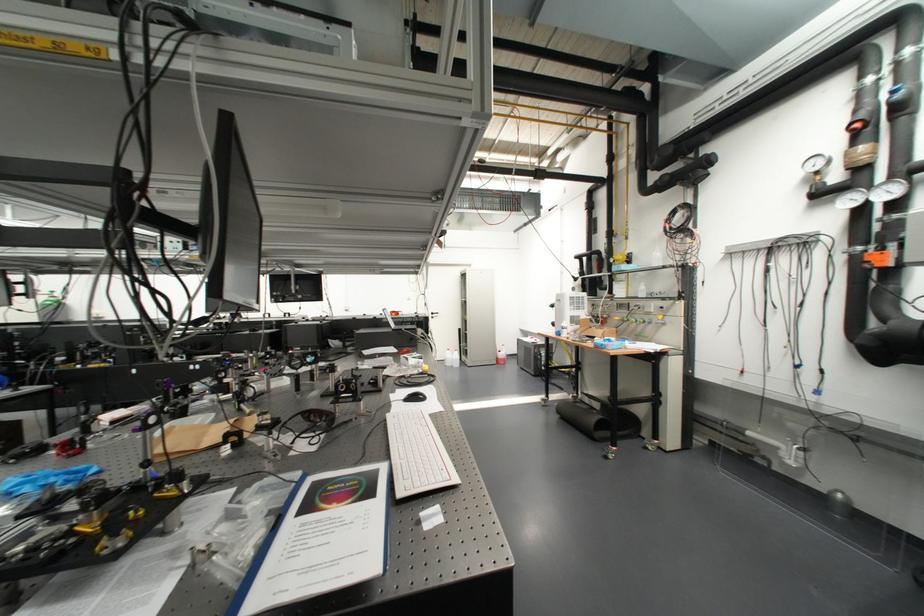
Where would you turn the red valve handle? Please return your answer as a coordinate pair (x, y).

(598, 264)